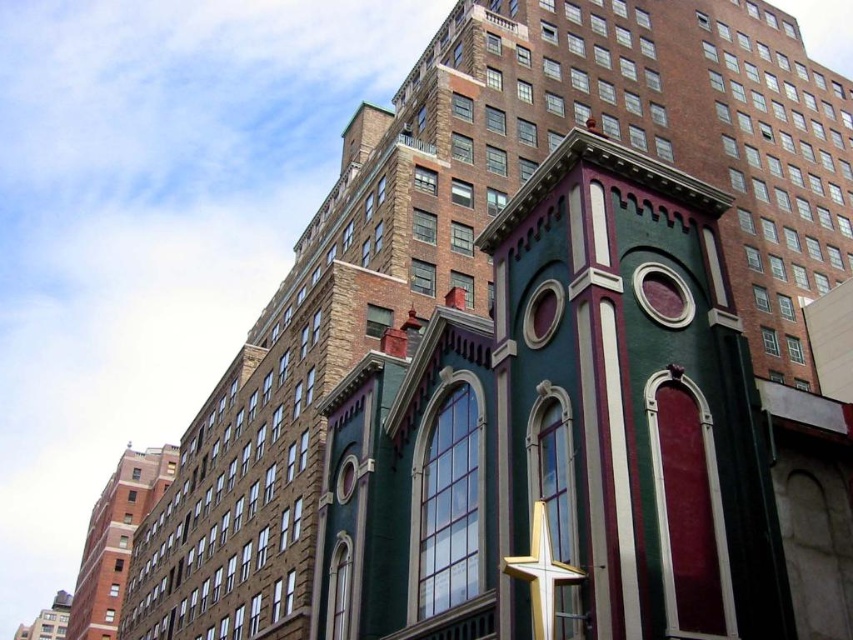
Question: Which point is farther to the camera?

Choices:
 (A) (112, 624)
 (B) (544, 589)
 (C) (62, 595)

Answer: (C)

Question: Which is nearer to the green painted brick church at lower left?

Choices:
 (A) green matte church at lower left
 (B) gold metallic star at center

Answer: (A)

Question: Which of the following is the farthest from the observer?

Choices:
 (A) (59, 611)
 (B) (102, 625)

Answer: (A)

Question: Is gold metallic star at center thinner than green matte church at lower left?

Choices:
 (A) yes
 (B) no

Answer: (A)

Question: Can you confirm if green painted brick church at lower left is bigger than green matte church at lower left?

Choices:
 (A) no
 (B) yes

Answer: (B)

Question: Does green painted brick church at lower left appear over gold metallic star at center?

Choices:
 (A) yes
 (B) no

Answer: (B)